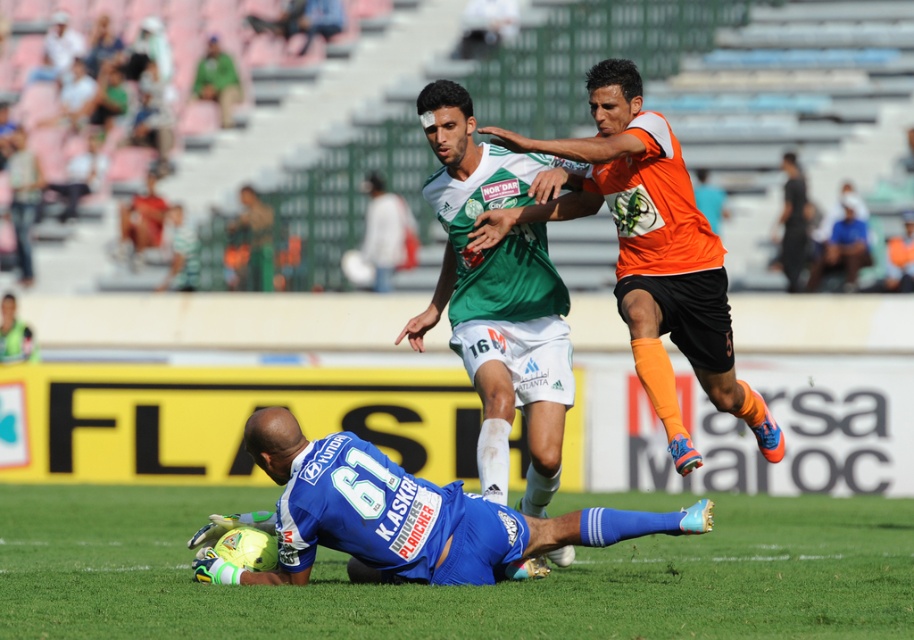
Does green jersey at center have a greater height compared to blue jersey at lower center?

Indeed, green jersey at center has a greater height compared to blue jersey at lower center.

Is the position of green jersey at center more distant than that of blue jersey at lower center?

Yes, it is.

Between point (516, 378) and point (273, 531), which one is positioned in front?

Point (273, 531) is more forward.

The image size is (914, 640). In order to click on green jersey at center in this screenshot , I will do `click(498, 292)`.

Is green grass at lower center shorter than green jersey at center?

Correct, green grass at lower center is not as tall as green jersey at center.

Who is more forward, (909,586) or (470,225)?

Point (909,586) is in front.

Where is `green grass at lower center`? Image resolution: width=914 pixels, height=640 pixels. green grass at lower center is located at coordinates (457, 586).

The height and width of the screenshot is (640, 914). What are the coordinates of `green grass at lower center` in the screenshot? It's located at (457, 586).

How far apart are green jersey at center and orange jersey at upper right?

green jersey at center is 26.17 inches away from orange jersey at upper right.

Is green jersey at center thinner than orange jersey at upper right?

Indeed, green jersey at center has a lesser width compared to orange jersey at upper right.

The height and width of the screenshot is (640, 914). Identify the location of green jersey at center. (498, 292).

Where is `green jersey at center`? The height and width of the screenshot is (640, 914). green jersey at center is located at coordinates (498, 292).